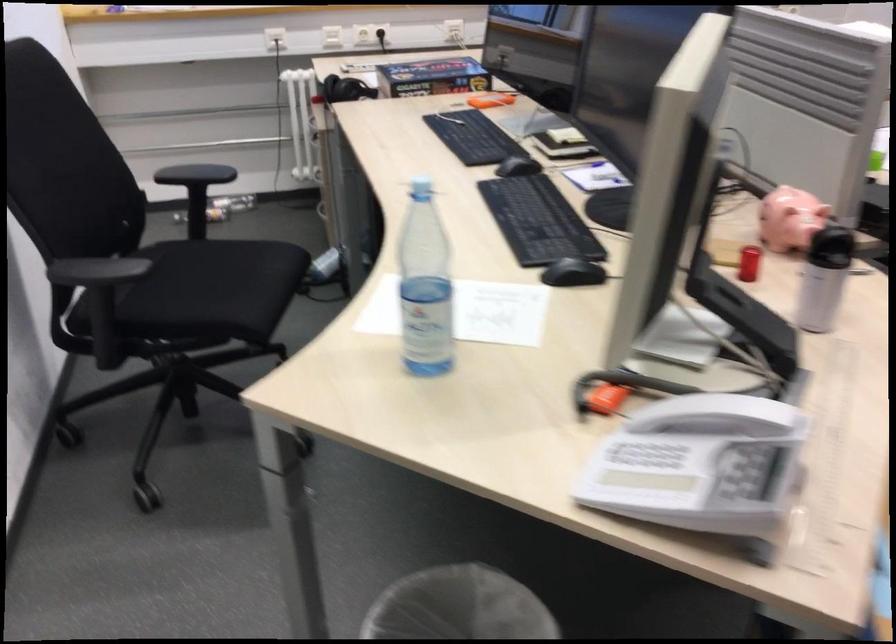
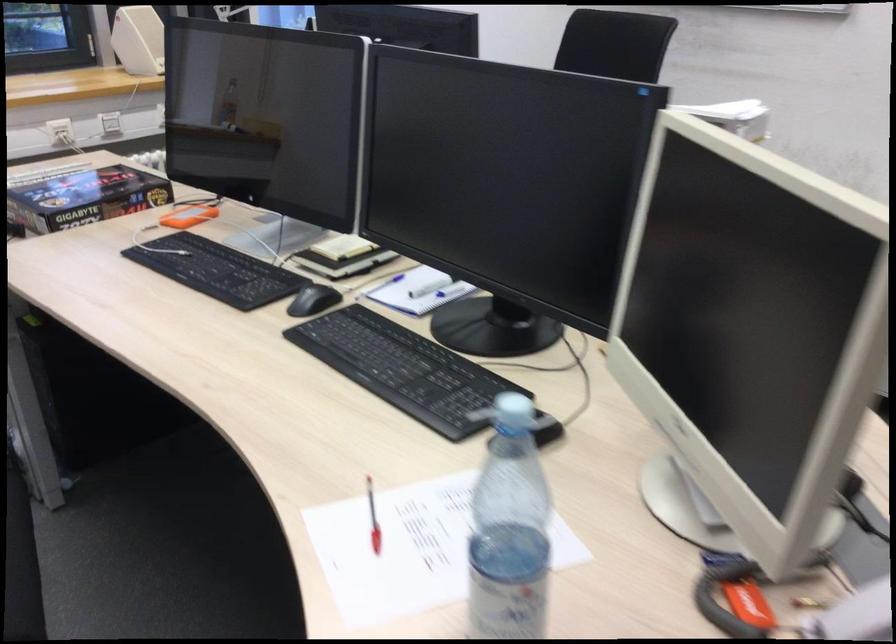
Where in the second image is the point corresponding to (581,272) from the first image?

(547, 431)